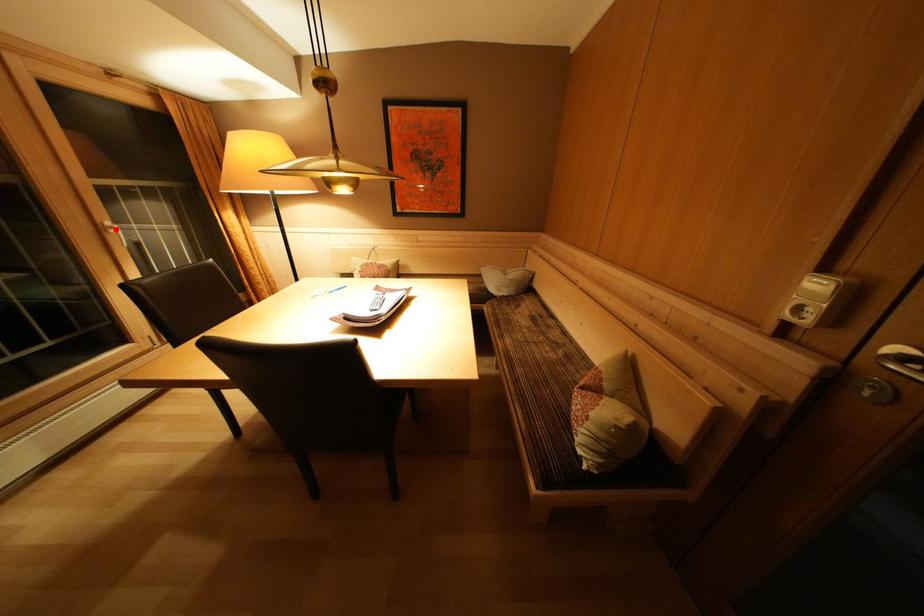
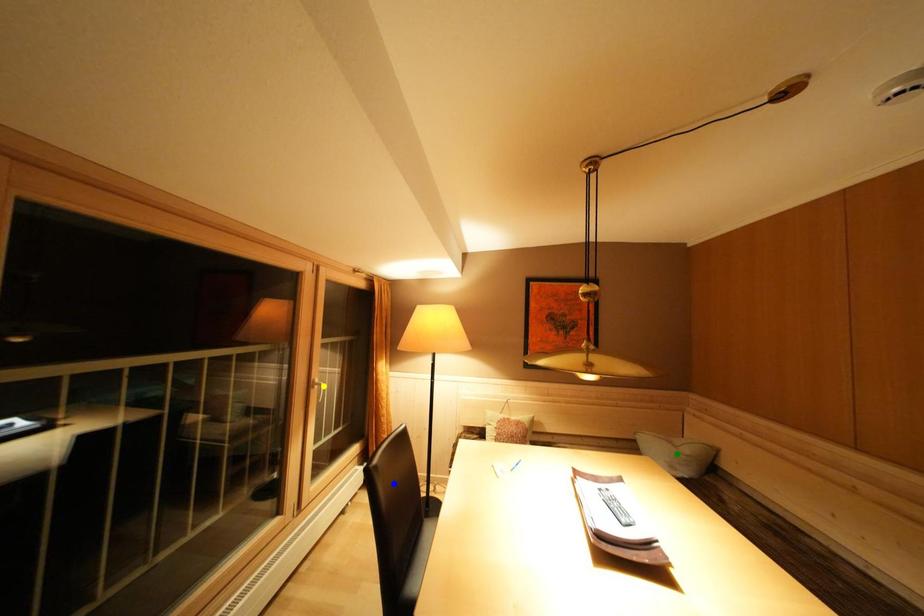
Question: I am providing you with two images of the same scene from different viewpoints. A red point is marked on the first image. You are given multiple points on the second image. In image 2, which mark is for the same physical point as the one in image 1?

Choices:
 (A) yellow point
 (B) blue point
 (C) green point

Answer: (A)